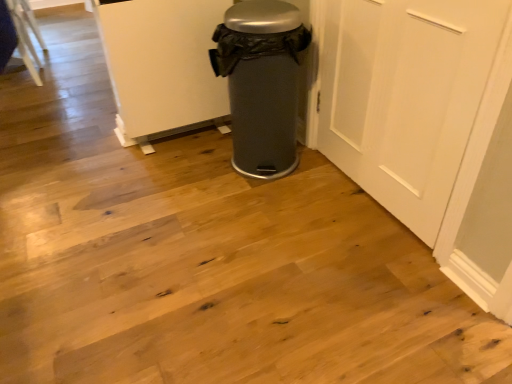
Measure the distance between point [25,62] and camera.

2.92 meters.

What do you see at coordinates (26, 35) in the screenshot?
I see `white plastic step stool at upper left` at bounding box center [26, 35].

Find the location of `white plastic step stool at upper left`. white plastic step stool at upper left is located at coordinates (26, 35).

What is the approximate width of white plastic step stool at upper left?

white plastic step stool at upper left is 14.73 inches wide.

Find the location of `white plastic step stool at upper left`. white plastic step stool at upper left is located at coordinates (26, 35).